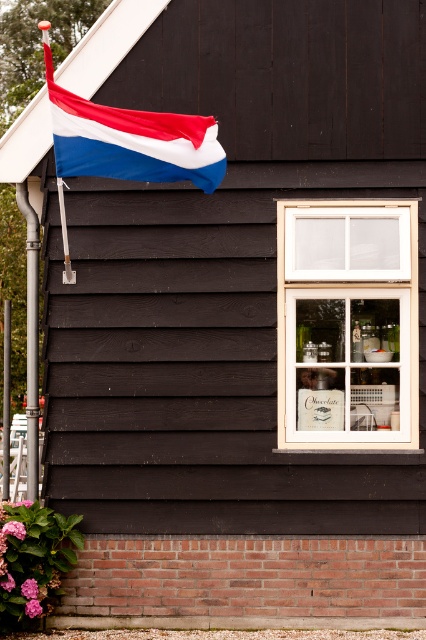
You are an architect analyzing the building facade. Which object has a larger vertical dimension between the white wooden window at center and the matte fabric flag at upper left?

The white wooden window at center has a greater height compared to the matte fabric flag at upper left.

You are standing in front of the building. Where is the white wooden window at center located relative to the point marked at coordinates (348,324)?

The white wooden window at center is exactly at the point marked at coordinates (348,324).

You are standing in front of the building and notice both the white wooden window at center and the matte fabric flag at upper left. Which object is positioned to the left when viewed from your perspective?

The matte fabric flag at upper left is positioned to the left of the white wooden window at center from your perspective.